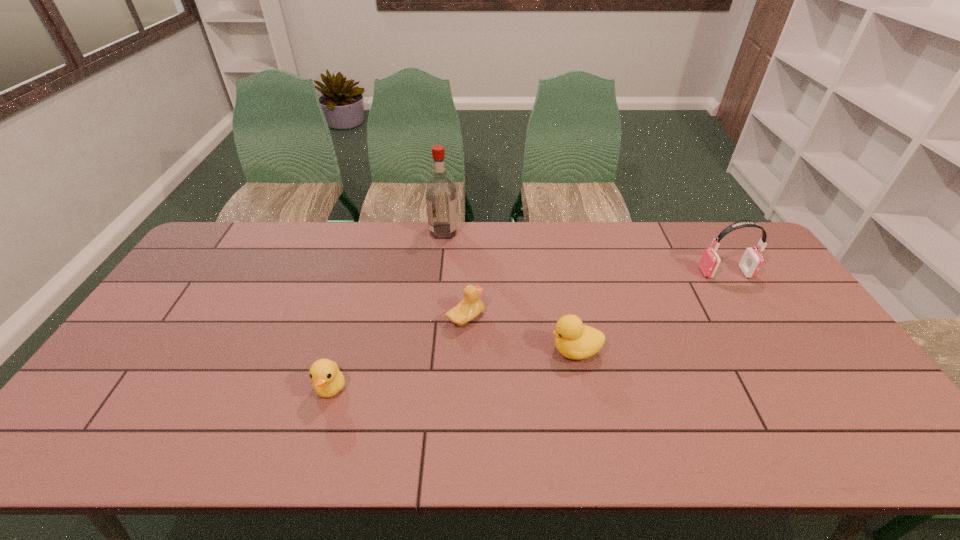
Find the location of `liquor`. liquor is located at coordinates (441, 203).

The height and width of the screenshot is (540, 960). Find the location of `the farthest object`. the farthest object is located at coordinates (441, 203).

Find the location of `the fourth shortest object`. the fourth shortest object is located at coordinates (751, 262).

You are a GUI agent. You are given a task and a screenshot of the screen. Output one action in this format:
    pyautogui.click(x=<x>, y=<y>)
    Task: Click on the fourth nearest object
    This screenshot has height=540, width=960.
    Given the screenshot: What is the action you would take?
    pyautogui.click(x=751, y=262)

At what (x,y) coordinates should I click in order to perform the action: click on the second nearest duck. Please return your answer as a coordinate pair (x, y). This screenshot has width=960, height=540. Looking at the image, I should click on (574, 340).

Identify the location of the second nearest object. This screenshot has width=960, height=540. (574, 340).

At what (x,y) coordinates should I click in order to perform the action: click on the farthest duck. Please return your answer as a coordinate pair (x, y). The width and height of the screenshot is (960, 540). Looking at the image, I should click on (471, 306).

Where is `the third nearest object`? the third nearest object is located at coordinates (471, 306).

Locate an element on the screen. The height and width of the screenshot is (540, 960). the nearest object is located at coordinates (328, 380).

Identify the location of the nearest duck. This screenshot has height=540, width=960. (328, 380).